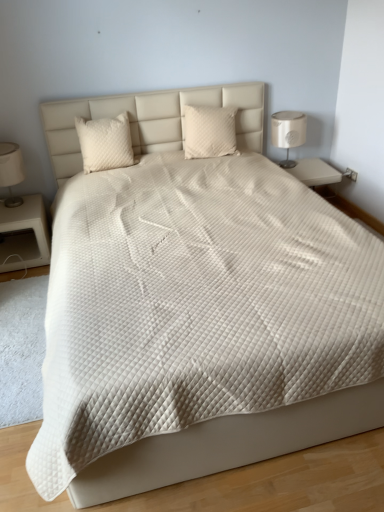
At what (x,y) coordinates should I click in order to perform the action: click on free space below matte white lampshade at left, positioned as the 2th bedside lamp in right-to-left order (from a real-world perspective). Please return your answer as a coordinate pair (x, y). Image resolution: width=384 pixels, height=512 pixels. Looking at the image, I should click on (16, 198).